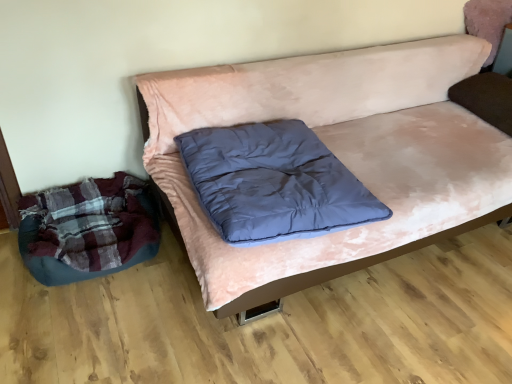
The height and width of the screenshot is (384, 512). What do you see at coordinates (338, 156) in the screenshot?
I see `pink velvety couch at center` at bounding box center [338, 156].

Measure the distance between point [279,63] and camera.

Point [279,63] and camera are 6.42 feet apart.

Where is `dark blue down at center`? dark blue down at center is located at coordinates (273, 183).

Locate an element on the screen. This screenshot has width=512, height=384. pink velvety couch at center is located at coordinates (338, 156).

Based on their positions, is dark blue down at center located to the left or right of plush dark blue bean bag at lower left?

From the image, it's evident that dark blue down at center is to the right of plush dark blue bean bag at lower left.

Can you confirm if dark blue down at center is smaller than plush dark blue bean bag at lower left?

Incorrect, dark blue down at center is not smaller in size than plush dark blue bean bag at lower left.

Is dark blue down at center touching plush dark blue bean bag at lower left?

dark blue down at center and plush dark blue bean bag at lower left are clearly separated.

Between dark blue down at center and plush dark blue bean bag at lower left, which one has more height?

With more height is plush dark blue bean bag at lower left.

From the image's perspective, is dark blue down at center located beneath pink velvety couch at center?

Yes, from the image's perspective, dark blue down at center is beneath pink velvety couch at center.

Would you say dark blue down at center is inside or outside pink velvety couch at center?

dark blue down at center is enclosed within pink velvety couch at center.

In the image, is dark blue down at center on the left side or the right side of pink velvety couch at center?

dark blue down at center is to the left of pink velvety couch at center.

Identify the location of pillow that is behind the pink velvety couch at center. (273, 183).

In the scene shown: From the image's perspective, which object appears higher, pink velvety couch at center or dark blue down at center?

pink velvety couch at center.

Is pink velvety couch at center not inside dark blue down at center?

Absolutely, pink velvety couch at center is external to dark blue down at center.

Which is behind, point (444, 60) or point (290, 217)?

Point (444, 60)

From a real-world perspective, who is located higher, plush dark blue bean bag at lower left or dark blue down at center?

dark blue down at center is physically above.

Considering the sizes of objects plush dark blue bean bag at lower left and dark blue down at center in the image provided, who is thinner, plush dark blue bean bag at lower left or dark blue down at center?

plush dark blue bean bag at lower left.

From the image's perspective, between plush dark blue bean bag at lower left and dark blue down at center, which one is located above?

dark blue down at center, from the image's perspective.

Considering their positions, is plush dark blue bean bag at lower left located in front of or behind dark blue down at center?

Clearly, plush dark blue bean bag at lower left is behind dark blue down at center.

Are pink velvety couch at center and plush dark blue bean bag at lower left located far from each other?

Actually, pink velvety couch at center and plush dark blue bean bag at lower left are a little close together.

From the image's perspective, which one is positioned lower, pink velvety couch at center or plush dark blue bean bag at lower left?

From the image's view, plush dark blue bean bag at lower left is below.

Is the position of pink velvety couch at center more distant than that of plush dark blue bean bag at lower left?

No.

Based on the photo, is plush dark blue bean bag at lower left positioned with its back to pink velvety couch at center?

No, pink velvety couch at center is not at the back of plush dark blue bean bag at lower left.

From the image's perspective, is plush dark blue bean bag at lower left above or below pink velvety couch at center?

From the image's perspective, plush dark blue bean bag at lower left appears below pink velvety couch at center.

From a real-world perspective, which object stands above the other?

pink velvety couch at center, from a real-world perspective.

In order to click on pillow in front of the plush dark blue bean bag at lower left in this screenshot , I will do `click(273, 183)`.

You are a GUI agent. You are given a task and a screenshot of the screen. Output one action in this format:
    pyautogui.click(x=<x>, y=<y>)
    Task: Click on the pillow behind the pink velvety couch at center
    This screenshot has width=512, height=384.
    Given the screenshot: What is the action you would take?
    pyautogui.click(x=273, y=183)

Based on their spatial positions, is dark blue down at center or plush dark blue bean bag at lower left further from pink velvety couch at center?

plush dark blue bean bag at lower left.

Considering their positions, is dark blue down at center positioned closer to plush dark blue bean bag at lower left than pink velvety couch at center?

dark blue down at center.

From the image, which object appears to be nearer to pink velvety couch at center, plush dark blue bean bag at lower left or dark blue down at center?

dark blue down at center lies closer to pink velvety couch at center than the other object.

When comparing their distances from plush dark blue bean bag at lower left, does pink velvety couch at center or dark blue down at center seem closer?

Among the two, dark blue down at center is located nearer to plush dark blue bean bag at lower left.

Which object lies nearer to the anchor point dark blue down at center, plush dark blue bean bag at lower left or pink velvety couch at center?

Among the two, pink velvety couch at center is located nearer to dark blue down at center.

Considering their positions, is pink velvety couch at center positioned closer to dark blue down at center than plush dark blue bean bag at lower left?

Based on the image, pink velvety couch at center appears to be nearer to dark blue down at center.

The image size is (512, 384). What are the coordinates of `pillow situated between plush dark blue bean bag at lower left and pink velvety couch at center from left to right` in the screenshot? It's located at (273, 183).